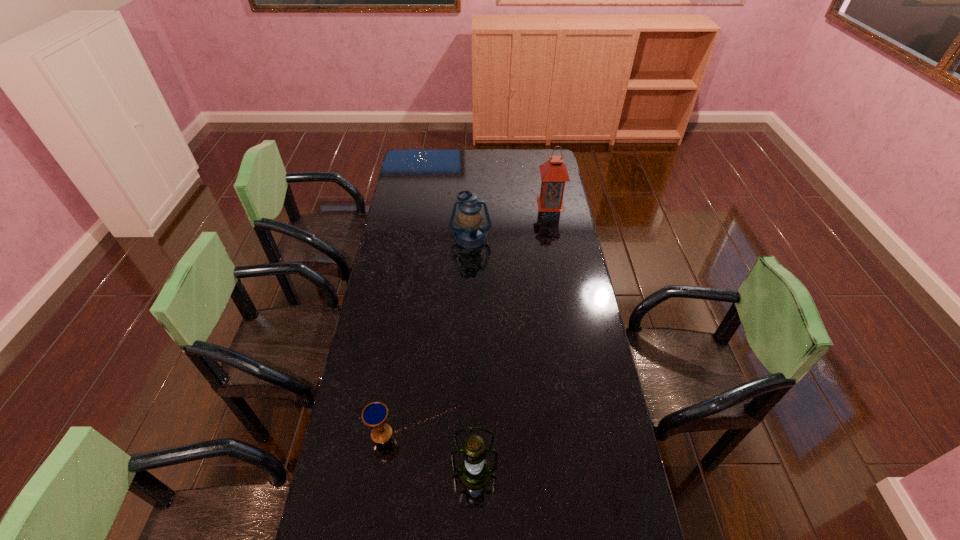
Locate an element on the screen. The width and height of the screenshot is (960, 540). the rightmost object is located at coordinates (554, 174).

Locate an element on the screen. the farthest object is located at coordinates (554, 174).

Identify the location of the nearest object. (474, 473).

This screenshot has width=960, height=540. Find the location of `the second farthest object`. the second farthest object is located at coordinates (470, 234).

Find the location of a particular element. Image resolution: width=960 pixels, height=540 pixels. the second nearest lantern is located at coordinates (470, 234).

This screenshot has height=540, width=960. What are the coordinates of `the shortest object` in the screenshot? It's located at (375, 415).

I want to click on chalice, so click(375, 415).

Identify the location of free space located 0.350m on the front of the rightmost lantern. (561, 262).

What are the coordinates of `vacant space located 0.180m on the face of the shortest lantern` in the screenshot? It's located at (469, 279).

Where is `vacant region located 0.230m on the front of the third farthest object`? The image size is (960, 540). vacant region located 0.230m on the front of the third farthest object is located at coordinates (366, 530).